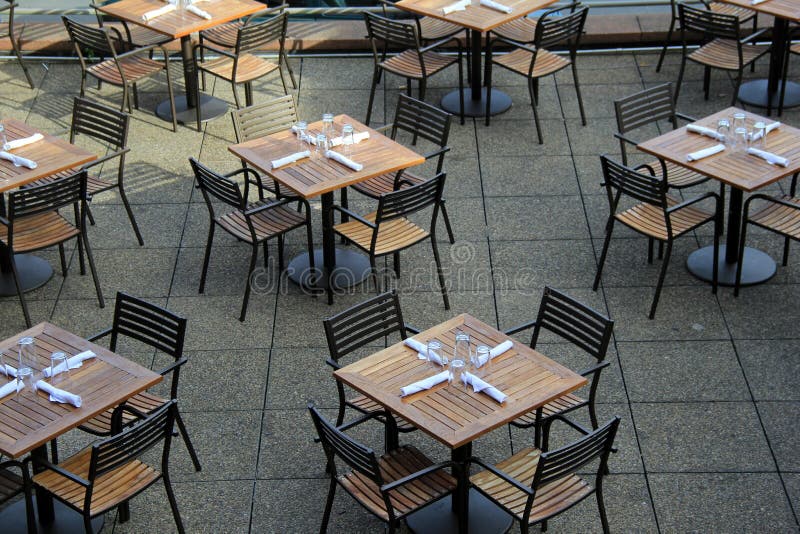
The image size is (800, 534). I want to click on tables, so click(88, 390), click(28, 157), click(170, 21), click(326, 158), click(480, 5), click(733, 152), click(776, 7), click(476, 380).